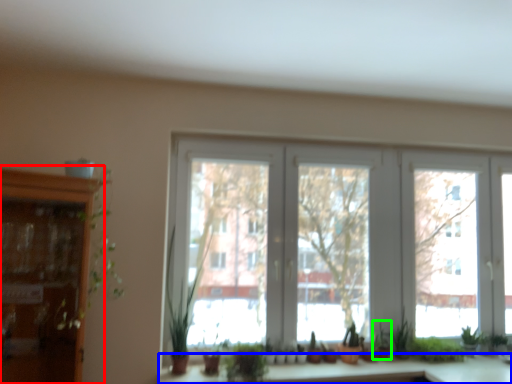
Question: Considering the real-world distances, which object is farthest from cabinetry (highlighted by a red box)? counter top (highlighted by a blue box) or plant (highlighted by a green box)?

Choices:
 (A) counter top
 (B) plant

Answer: (B)